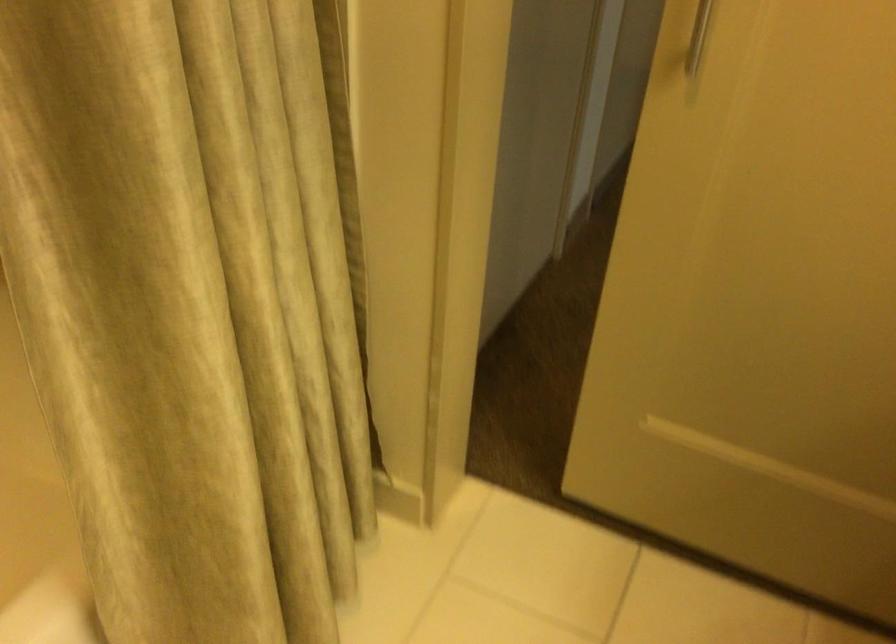
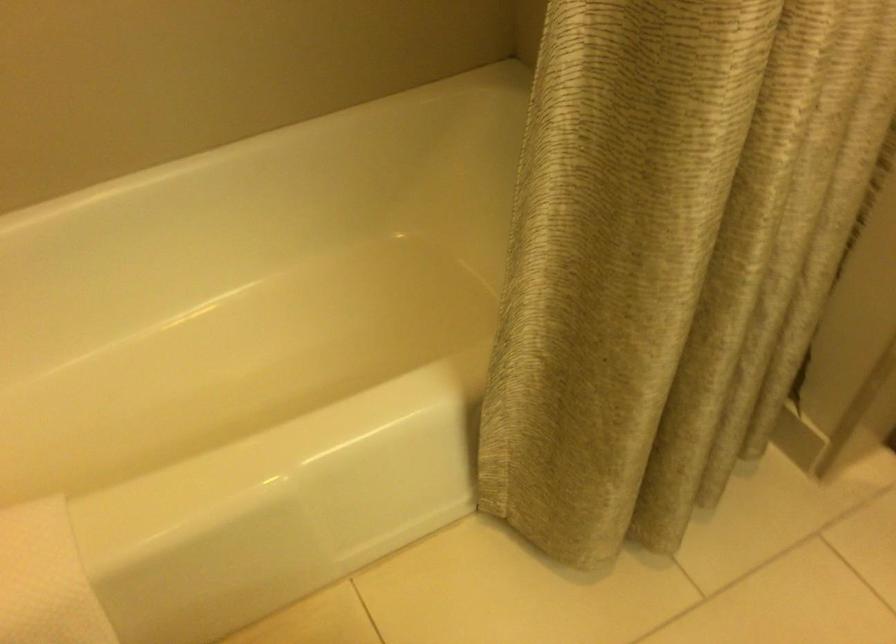
The point at (x=190, y=412) is marked in the first image. Where is the corresponding point in the second image?

(643, 254)